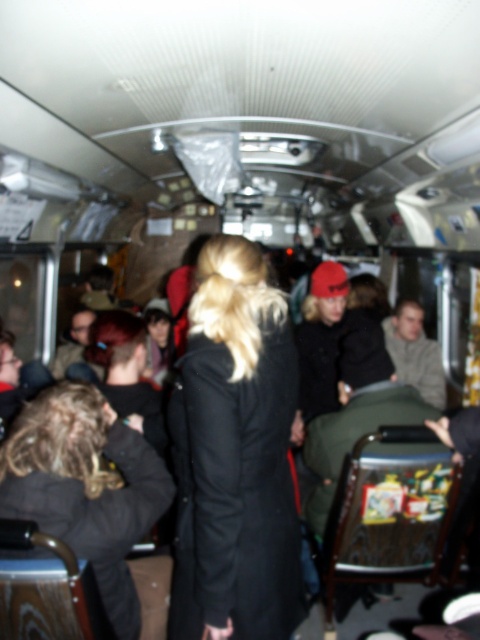
You are a passenger on a crowded bus and need to retrieve your bag from the overhead compartment. You see the black wool coat at center and the dark brown leather jacket at lower left. Which item is taller and might be blocking your path to the compartment?

The black wool coat at center is taller than the dark brown leather jacket at lower left, so it might be blocking your path to the overhead compartment.

You are a passenger on the bus and need to retrieve your black wool coat at center. The bus has an exit door at the back. Can you walk directly to the exit door without moving any items from the seats?

The black wool coat at center is located at point (x=235, y=452), which means it is positioned in the central area of the bus. Since the seats have items like bags or personal belongings on them, you may need to move some items to create a path to the exit door at the back.